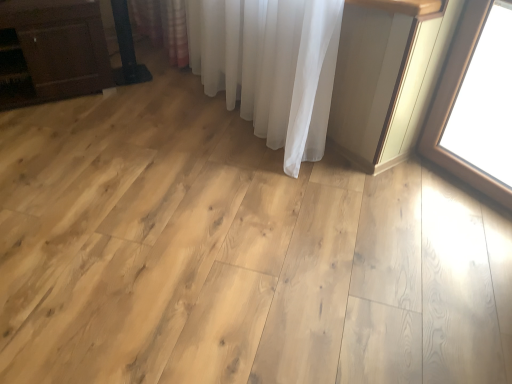
Where is `vacant area that is in front of white sheer curtain at center`? vacant area that is in front of white sheer curtain at center is located at coordinates (247, 239).